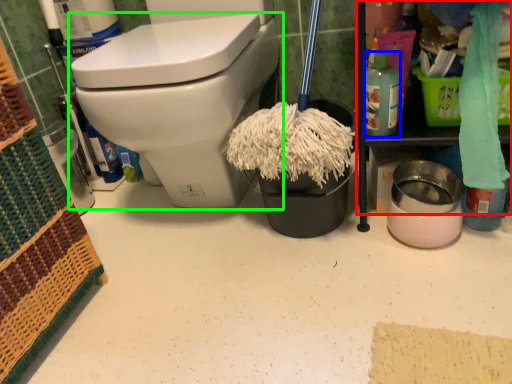
Question: Based on their relative distances, which object is farther from cabinetry (highlighted by a red box)? Choose from cleaning product (highlighted by a blue box) and toilet (highlighted by a green box).

Choices:
 (A) cleaning product
 (B) toilet

Answer: (B)